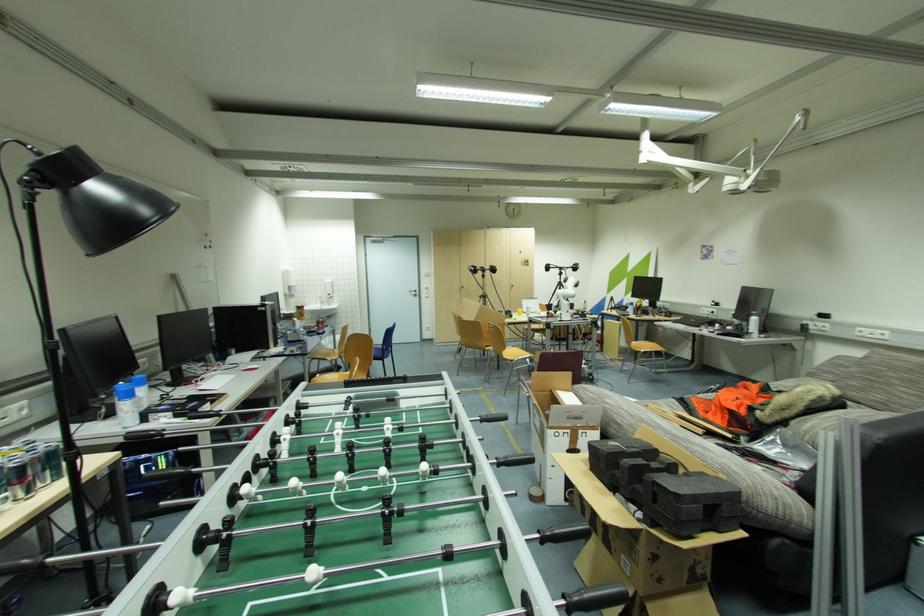
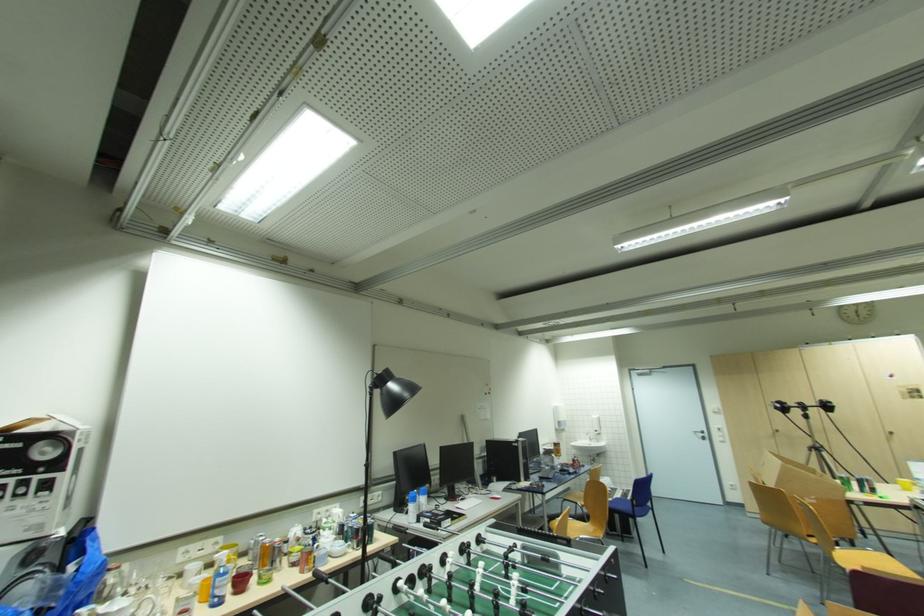
Find the pixel in the second image that matches point 388,351 in the first image.

(639, 506)